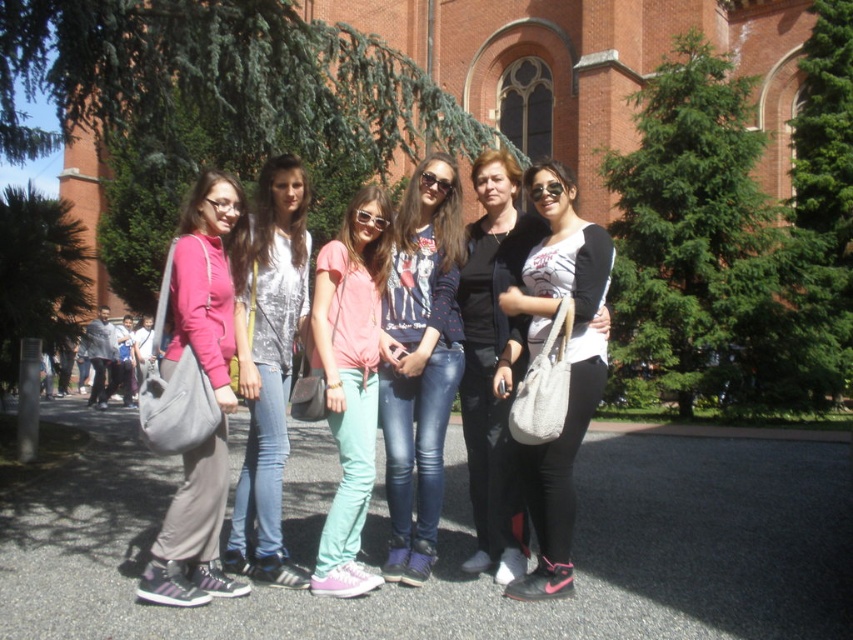
You are a photographer trying to adjust the lighting for a group photo. You notice the matte pink hoodie at left and the black matte jacket at center. Which clothing item is closer to the camera based on their positions?

The matte pink hoodie at left is closer to the camera since it is in front of the black matte jacket at center.

You are a photographer trying to capture a closeup of the shiny silver top at center without the white matte bag at center appearing in the frame. Is this possible given their positions?

The white matte bag at center is below the shiny silver top at center, so if you position the camera to focus on the top part of the shiny silver top at center and avoid the lower area where the white matte bag at center is located, it should be possible to capture the closeup without the bag appearing in the frame.

You are standing in front of the large brick building with arched windows and see the point at coordinates (195, 392). Which object does this point lie on?

The point at coordinates (195, 392) lies on the matte pink hoodie at left.